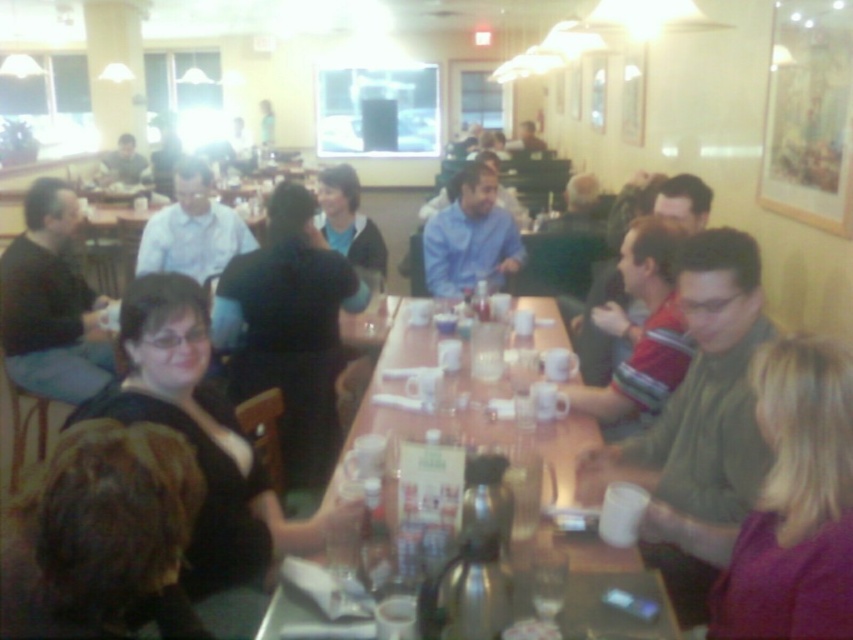
You are a customer in the restaurant and want to see the person wearing the matte black shirt at left and the matte black shirt at upper left. Which one is closer to you?

The matte black shirt at left is closer to you because it is in front of the matte black shirt at upper left.

You are a customer trying to find a seat in this busy restaurant. You notice the wooden table at center and the matte black shirt at upper left. Which object is closer to you?

The wooden table at center is closer to you than the matte black shirt at upper left.